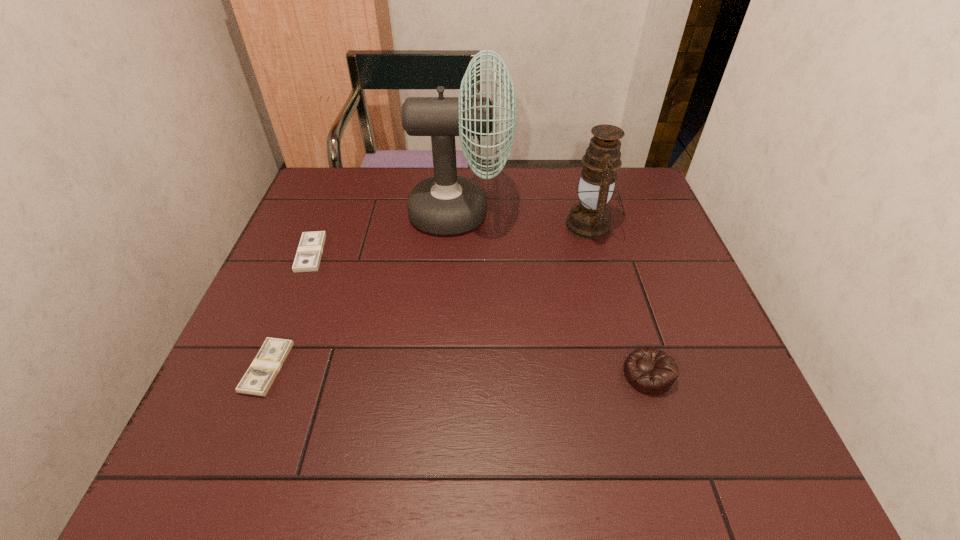
Locate an element on the screen. Image resolution: width=960 pixels, height=540 pixels. vacant area that satisfies the following two spatial constraints: 1. on the front side of the fourth shortest object; 2. on the right side of the third tallest object is located at coordinates click(633, 374).